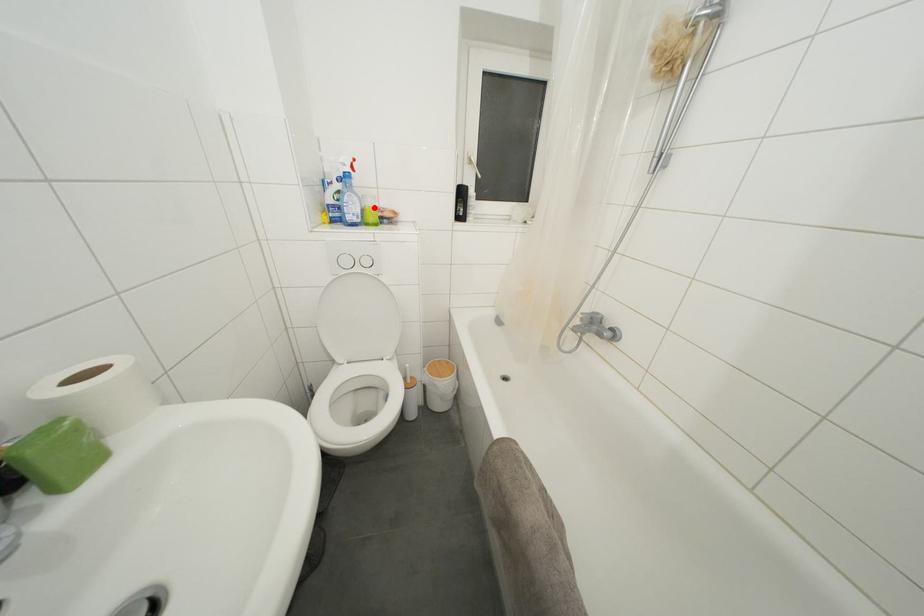
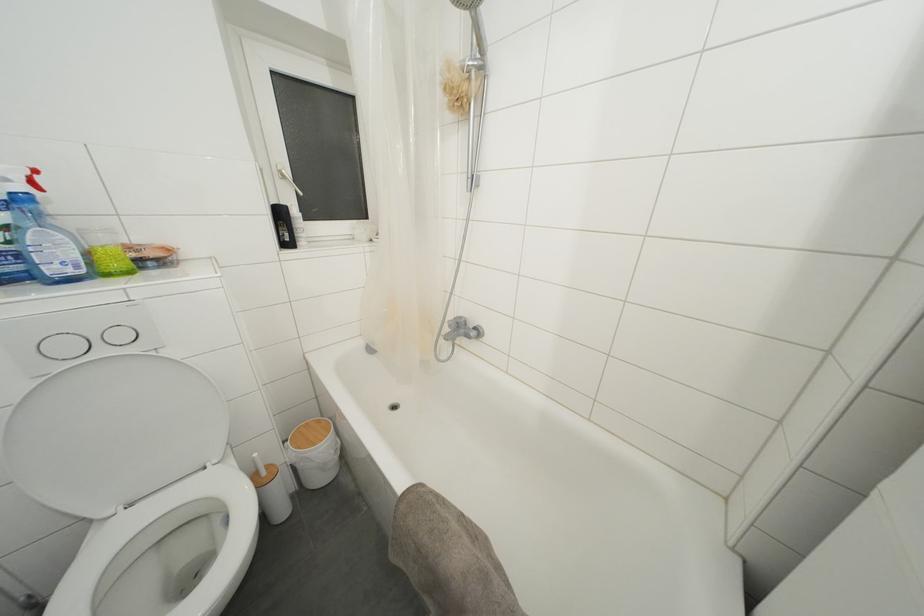
In the second image, find the point that corresponds to the highlighted location in the first image.

(108, 245)